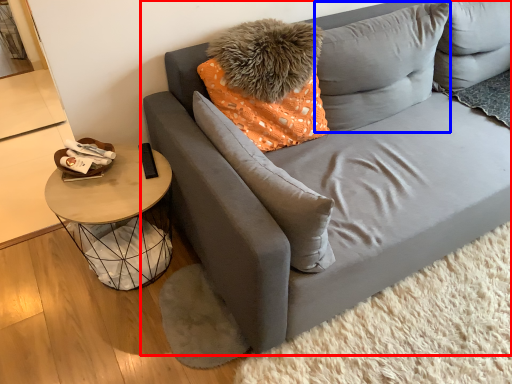
Question: Which point is closer to the camera, studio couch (highlighted by a red box) or pillow (highlighted by a blue box)?

Choices:
 (A) studio couch
 (B) pillow

Answer: (A)